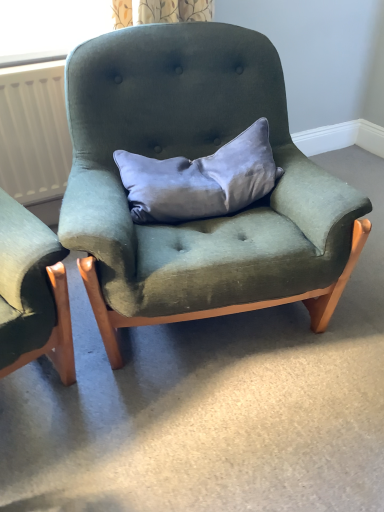
Question: Visually, is satin gray pillow at center positioned to the left or to the right of white matte radiator at left?

Choices:
 (A) right
 (B) left

Answer: (A)

Question: In terms of height, does satin gray pillow at center look taller or shorter compared to white matte radiator at left?

Choices:
 (A) tall
 (B) short

Answer: (B)

Question: Considering the real-world distances, which object is farthest from the velvet green armchair at center?

Choices:
 (A) white matte radiator at left
 (B) satin gray pillow at center

Answer: (A)

Question: Which of these objects is positioned closest to the white matte radiator at left?

Choices:
 (A) satin gray pillow at center
 (B) velvet green armchair at center

Answer: (B)